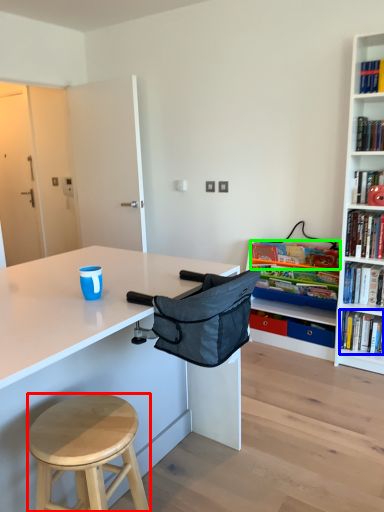
Question: Based on their relative distances, which object is farther from stool (highlighted by a red box)? Choose from book (highlighted by a blue box) and book (highlighted by a green box).

Choices:
 (A) book
 (B) book

Answer: (B)